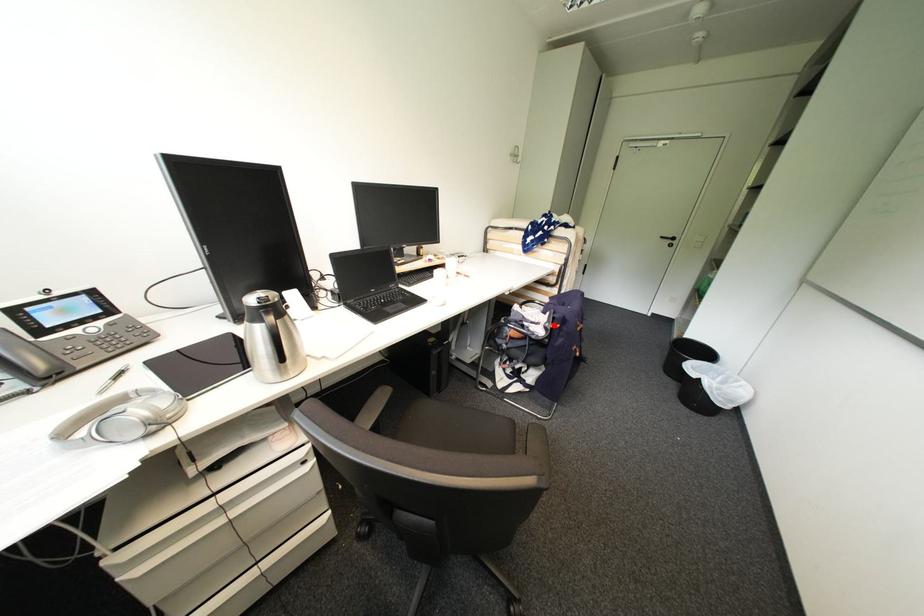
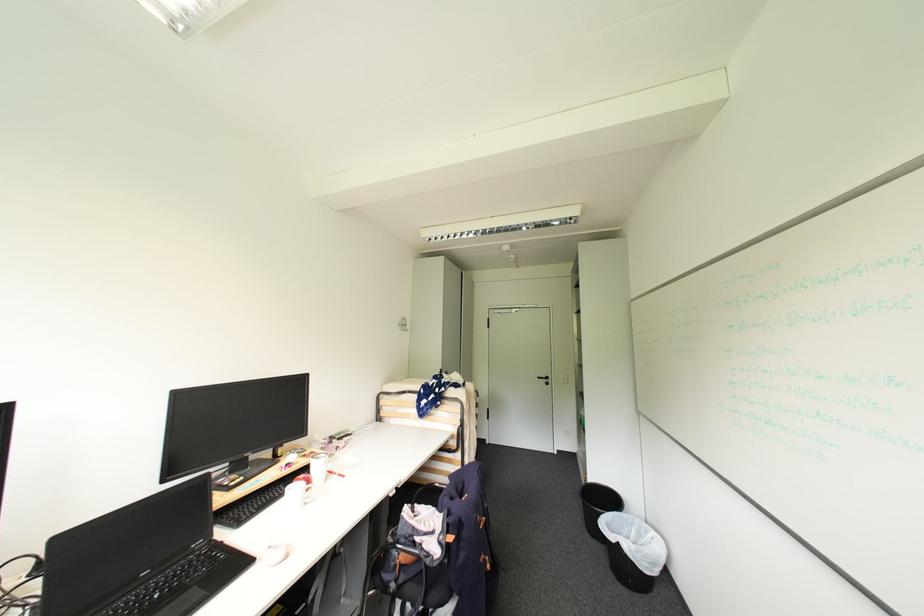
Where in the second image is the point corresponding to the highlighted location from the first image?

(447, 538)